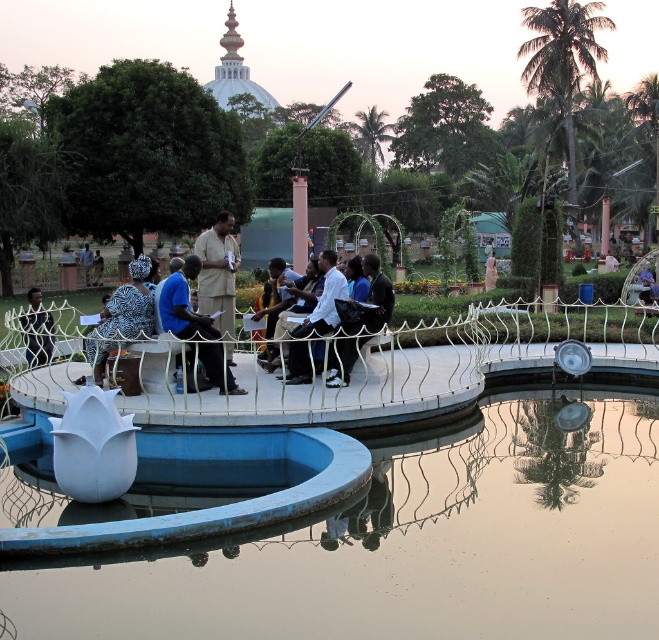
Which of these two, white glossy fountain at center or dark blue fabric jacket at left, stands shorter?

dark blue fabric jacket at left is shorter.

Is white glossy fountain at center to the left of dark blue fabric jacket at left from the viewer's perspective?

Correct, you'll find white glossy fountain at center to the left of dark blue fabric jacket at left.

Which is in front, point (270, 12) or point (32, 288)?

Positioned in front is point (32, 288).

At what (x,y) coordinates should I click in order to perform the action: click on white glossy fountain at center. Please return your answer as a coordinate pair (x, y). Looking at the image, I should click on (384, 49).

Who is taller, white shirt at center or dark blue fabric jacket at left?

Standing taller between the two is white shirt at center.

Who is positioned more to the left, white shirt at center or dark blue fabric jacket at left?

dark blue fabric jacket at left is more to the left.

The image size is (659, 640). What are the coordinates of `white shirt at center` in the screenshot? It's located at (324, 300).

Is dark blue jeans at center positioned before white shirt at center?

Yes, dark blue jeans at center is in front of white shirt at center.

This screenshot has width=659, height=640. In order to click on dark blue jeans at center in this screenshot , I will do `click(362, 321)`.